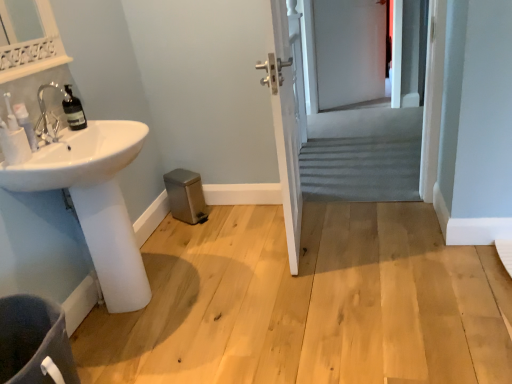
Locate an element on the screen. The width and height of the screenshot is (512, 384). vacant space behind white glossy sink at lower left is located at coordinates (181, 241).